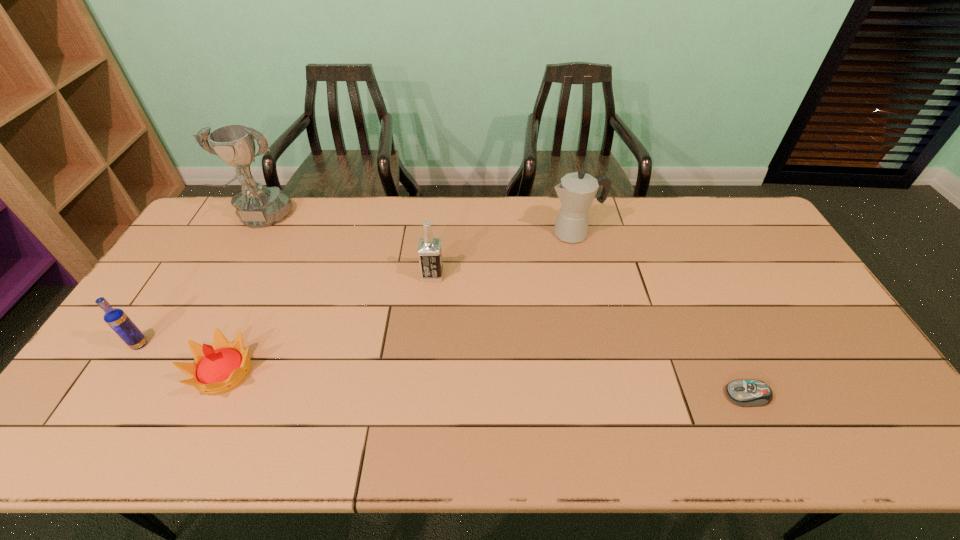
Where is `object that is the third nearest to the nearer vodka`? The height and width of the screenshot is (540, 960). object that is the third nearest to the nearer vodka is located at coordinates (429, 252).